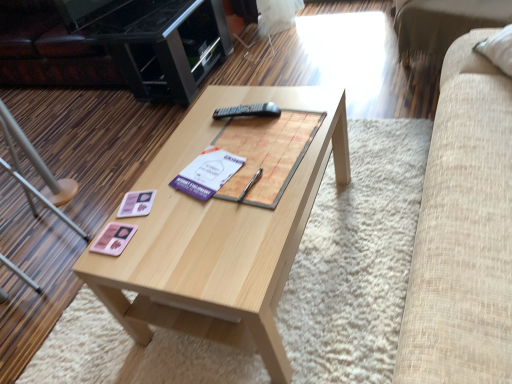
Where is `vacant space situated above light wood coffee table at center (from a real-world perspective)`? vacant space situated above light wood coffee table at center (from a real-world perspective) is located at coordinates (225, 170).